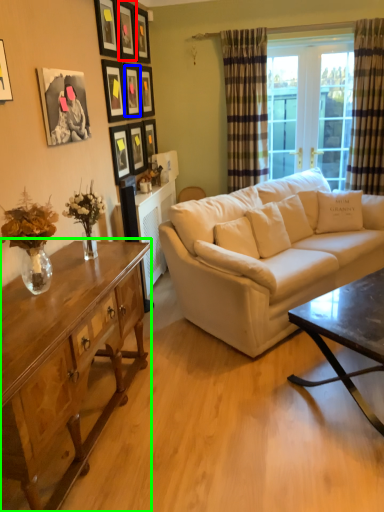
Question: Based on their relative distances, which object is farther from picture frame (highlighted by a red box)? Choose from picture frame (highlighted by a blue box) and coffee table (highlighted by a green box).

Choices:
 (A) picture frame
 (B) coffee table

Answer: (B)